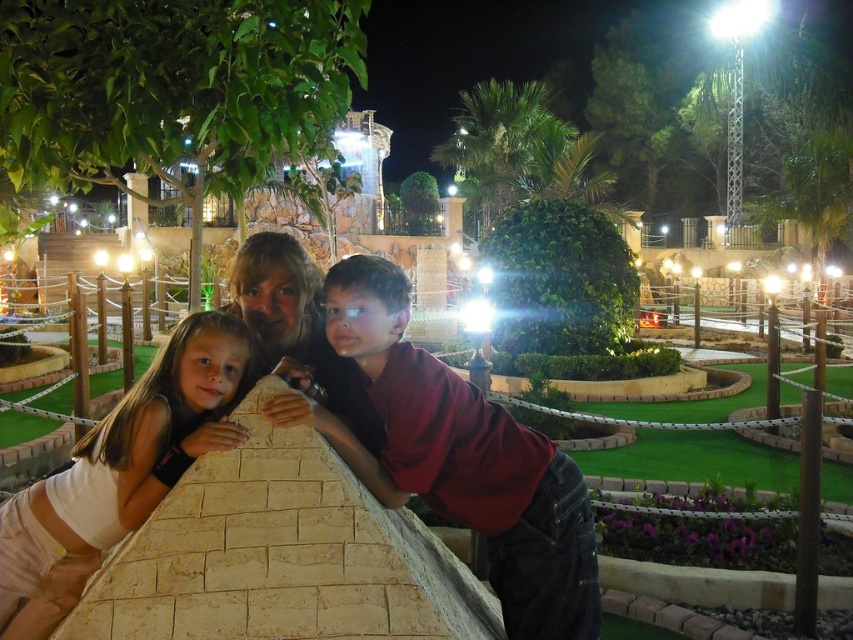
You are standing at the entrance of the miniature golf course and see two people wearing shirts of different colors at the center. The maroon fabric shirt at center and the white matte shirt at center. If you want to greet both of them, which one should you walk towards first if you want to greet the person closer to you?

The maroon fabric shirt at center is 5.04 meters away from the white matte shirt at center. Since you want to greet the person closer to you, you should walk towards the white matte shirt at center first because it is closer to your position at the entrance compared to the maroon fabric shirt at center.